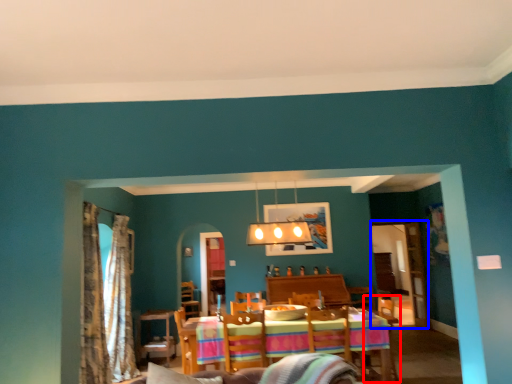
Question: Which of the following is the farthest to the observer, armchair (highlighted by a red box) or glass door (highlighted by a blue box)?

Choices:
 (A) armchair
 (B) glass door

Answer: (B)